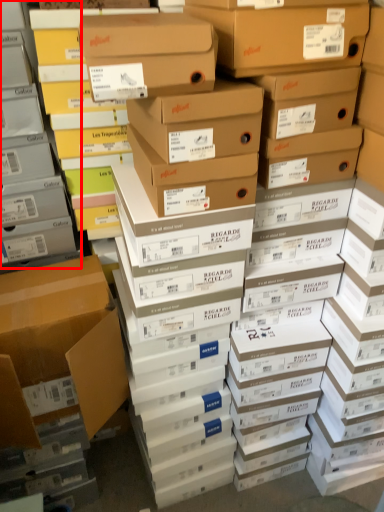
Question: In this image, where is shelf (annotated by the red box) located relative to box?

Choices:
 (A) right
 (B) left

Answer: (B)